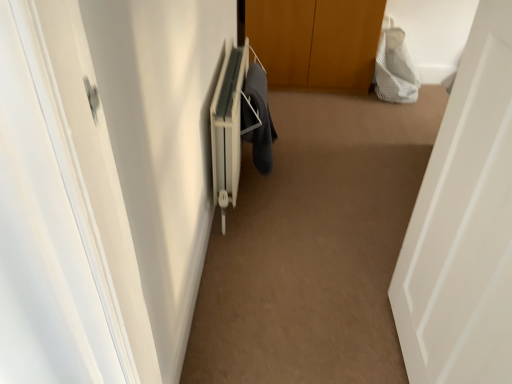
Image resolution: width=512 pixels, height=384 pixels. In order to click on white matte door at right in this screenshot , I will do `click(464, 225)`.

Is dark gray fabric at center completely or partially inside white striped fabric at upper right?

No, white striped fabric at upper right does not contain dark gray fabric at center.

Which is in front, white striped fabric at upper right or dark gray fabric at center?

Positioned in front is dark gray fabric at center.

Based on the photo, which of these two, white striped fabric at upper right or dark gray fabric at center, is smaller?

dark gray fabric at center.

From the picture: Is white striped fabric at upper right not near white matte door at right?

Yes, white striped fabric at upper right is far from white matte door at right.

From the image's perspective, is white striped fabric at upper right above white matte door at right?

Correct, white striped fabric at upper right appears higher than white matte door at right in the image.

Which is in front, white striped fabric at upper right or white matte door at right?

white matte door at right is closer to the camera.

Is white striped fabric at upper right looking in the opposite direction of white matte door at right?

No, white striped fabric at upper right is not facing away from white matte door at right.

Could you tell me if dark gray fabric at center is facing white striped fabric at upper right?

No, dark gray fabric at center is not oriented towards white striped fabric at upper right.

Who is bigger, dark gray fabric at center or white striped fabric at upper right?

white striped fabric at upper right.

From their relative heights in the image, would you say dark gray fabric at center is taller or shorter than white striped fabric at upper right?

Considering their sizes, dark gray fabric at center has less height than white striped fabric at upper right.

Is dark gray fabric at center inside the boundaries of white striped fabric at upper right, or outside?

dark gray fabric at center lies outside white striped fabric at upper right.

Can you confirm if white matte door at right is smaller than white striped fabric at upper right?

Yes, white matte door at right is smaller than white striped fabric at upper right.

Consider the image. From the image's perspective, would you say white matte door at right is positioned over white striped fabric at upper right?

Incorrect, from the image's perspective, white matte door at right is lower than white striped fabric at upper right.

From a real-world perspective, is white matte door at right located beneath white striped fabric at upper right?

Incorrect, from a real-world perspective, white matte door at right is higher than white striped fabric at upper right.

Can you tell me how much white matte door at right and dark gray fabric at center differ in facing direction?

91 degrees.

Is point (490, 368) in front of point (261, 125)?

That is True.

Is white matte door at right thinner than dark gray fabric at center?

No.

Who is shorter, dark gray fabric at center or white matte door at right?

Standing shorter between the two is dark gray fabric at center.

Would you say white matte door at right is part of dark gray fabric at center's contents?

That's incorrect, white matte door at right is not inside dark gray fabric at center.

Does point (258, 69) come closer to viewer compared to point (425, 198)?

That is False.

I want to click on laundry above the white striped fabric at upper right (from a real-world perspective), so click(260, 119).

The image size is (512, 384). I want to click on door below the white striped fabric at upper right (from the image's perspective), so click(x=464, y=225).

Which object lies further to the anchor point white striped fabric at upper right, white matte door at right or dark gray fabric at center?

The object further to white striped fabric at upper right is white matte door at right.

Considering their positions, is dark gray fabric at center positioned further to white striped fabric at upper right than white matte door at right?

white matte door at right lies further to white striped fabric at upper right than the other object.

Estimate the real-world distances between objects in this image. Which object is closer to white matte door at right, dark gray fabric at center or white striped fabric at upper right?

The object closer to white matte door at right is dark gray fabric at center.

Looking at the image, which one is located further to white matte door at right, white striped fabric at upper right or dark gray fabric at center?

white striped fabric at upper right lies further to white matte door at right than the other object.

When comparing their distances from dark gray fabric at center, does white striped fabric at upper right or white matte door at right seem further?

Based on the image, white striped fabric at upper right appears to be further to dark gray fabric at center.

From the image, which object appears to be nearer to dark gray fabric at center, white matte door at right or white striped fabric at upper right?

The object closer to dark gray fabric at center is white matte door at right.

Identify the location of laundry between white matte door at right and white striped fabric at upper right from front to back. (260, 119).